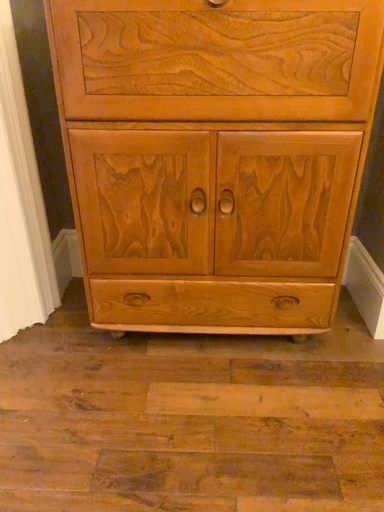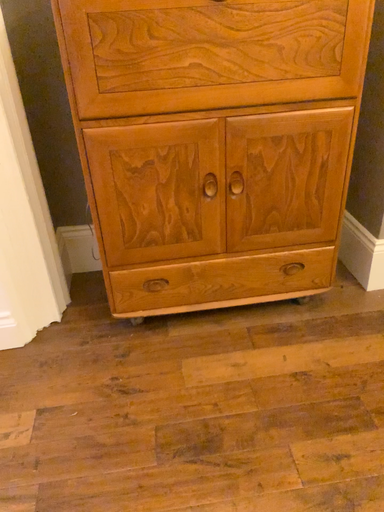
Question: How did the camera likely rotate when shooting the video?

Choices:
 (A) rotated left
 (B) rotated right

Answer: (B)